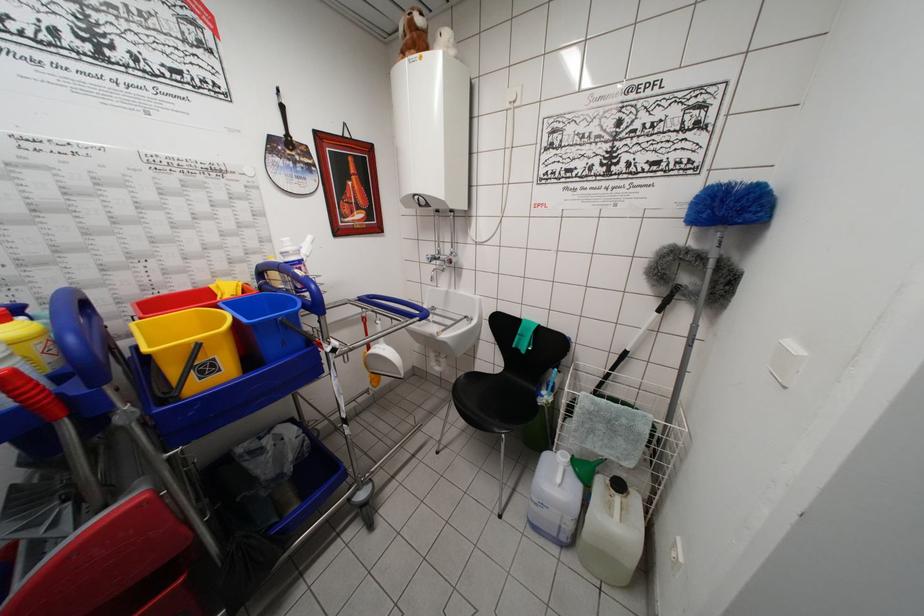
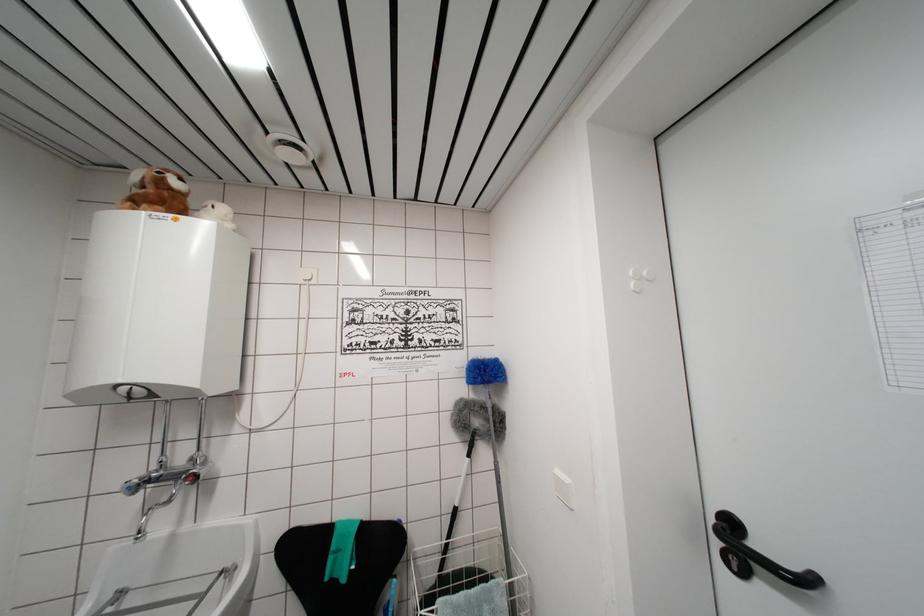
Locate, in the second image, the point that corresponds to point (462, 323) in the first image.

(209, 593)